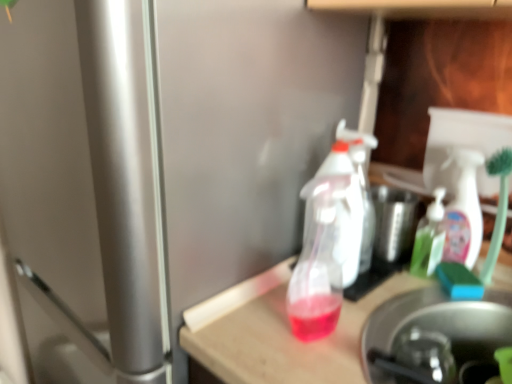
At what (x,y) coordinates should I click in order to perform the action: click on free point to the left of translucent plastic spray bottle at center, the 2th bottle positioned from the back. Please return your answer as a coordinate pair (x, y). Looking at the image, I should click on (248, 330).